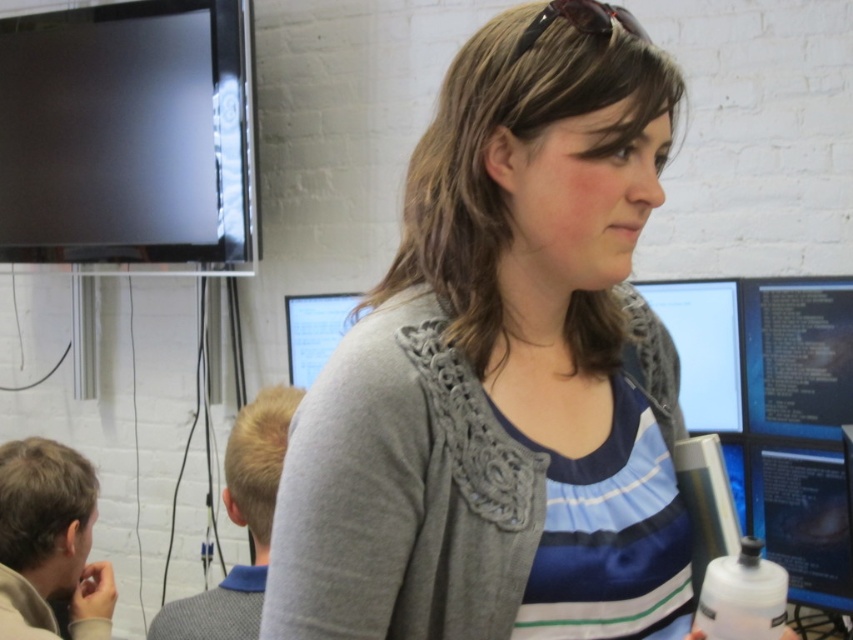
Is point (88, 141) positioned in front of point (808, 282)?

No, (88, 141) is behind (808, 282).

Between point (86, 189) and point (817, 340), which one is positioned in front?

Point (817, 340) is in front.

Describe the element at coordinates (126, 132) in the screenshot. I see `black glossy monitor at upper left` at that location.

Where is `black glossy monitor at upper left`? black glossy monitor at upper left is located at coordinates pos(126,132).

The image size is (853, 640). What do you see at coordinates (798, 355) in the screenshot?
I see `black glossy code at right` at bounding box center [798, 355].

The width and height of the screenshot is (853, 640). In order to click on black glossy code at right in this screenshot , I will do `click(798, 355)`.

You are a GUI agent. You are given a task and a screenshot of the screen. Output one action in this format:
    pyautogui.click(x=<x>, y=<y>)
    Task: Click on the black glossy code at right
    The width and height of the screenshot is (853, 640).
    Given the screenshot: What is the action you would take?
    pyautogui.click(x=798, y=355)

From the picture: Is gray knitted cardigan at center thinner than translucent plastic bottle at lower right?

In fact, gray knitted cardigan at center might be wider than translucent plastic bottle at lower right.

Does gray knitted cardigan at center appear on the left side of translucent plastic bottle at lower right?

Indeed, gray knitted cardigan at center is positioned on the left side of translucent plastic bottle at lower right.

You are a GUI agent. You are given a task and a screenshot of the screen. Output one action in this format:
    pyautogui.click(x=<x>, y=<y>)
    Task: Click on the gray knitted cardigan at center
    The image size is (853, 640).
    Given the screenshot: What is the action you would take?
    pos(503,369)

Where is `gray knitted cardigan at center`? gray knitted cardigan at center is located at coordinates (503, 369).